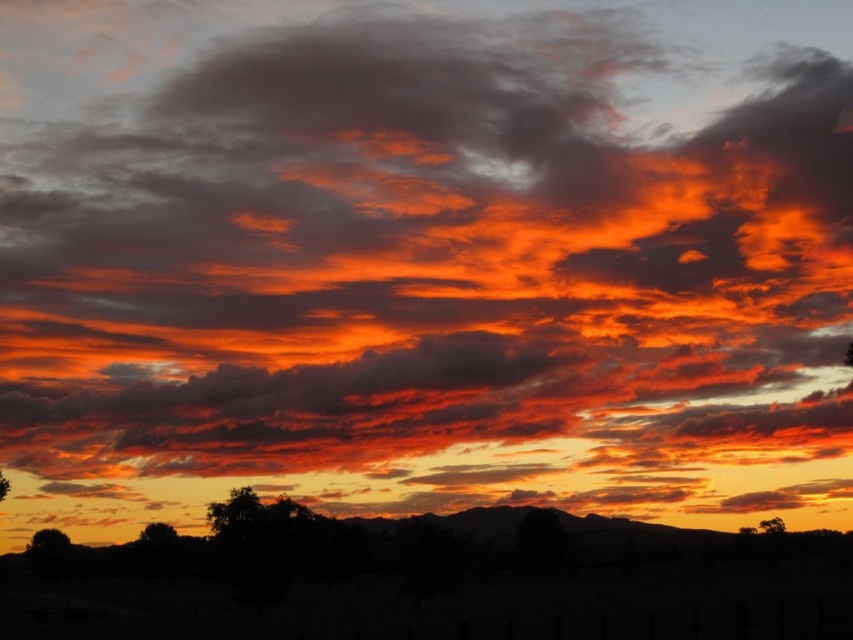
Question: Which point is farther from the camera taking this photo?

Choices:
 (A) (47, 552)
 (B) (242, 500)
 (C) (4, 496)
 (D) (171, 536)

Answer: (D)

Question: Which point appears farthest from the camera in this image?

Choices:
 (A) 0,477
 (B) 207,508

Answer: (B)

Question: Which point appears farthest from the camera in this image?

Choices:
 (A) (170, 524)
 (B) (39, 536)
 (C) (3, 480)
 (D) (230, 516)

Answer: (A)

Question: Can you confirm if silhouetted tree at center is positioned to the left of silhouette tree at lower left?

Choices:
 (A) yes
 (B) no

Answer: (B)

Question: In this image, where is green matte tree at lower left located relative to green leafy tree at lower right?

Choices:
 (A) above
 (B) below

Answer: (B)

Question: Is green matte tree at lower left closer to the viewer compared to green leafy tree at lower left?

Choices:
 (A) no
 (B) yes

Answer: (A)